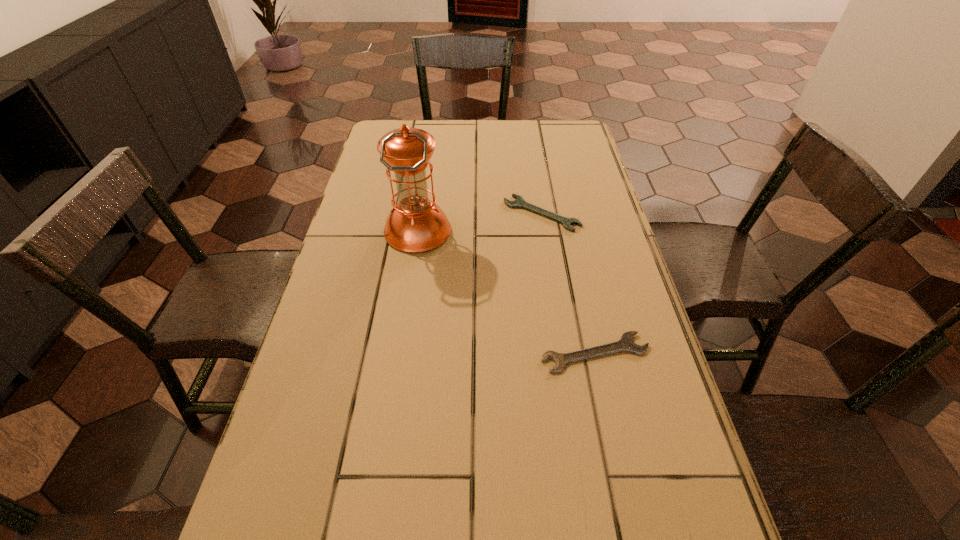
Select which object is the second closest to the farther wrench. Please provide its 2D coordinates. Your answer should be formatted as a tuple, i.e. [(x, y)], where the tuple contains the x and y coordinates of a point satisfying the conditions above.

[(626, 343)]

In order to click on object that is the nearest to the nearest object in this screenshot , I will do `click(416, 224)`.

The image size is (960, 540). Find the location of `vacant space that satisfies the following two spatial constraints: 1. on the back side of the leftmost object; 2. on the left side of the farther wrench`. vacant space that satisfies the following two spatial constraints: 1. on the back side of the leftmost object; 2. on the left side of the farther wrench is located at coordinates (420, 213).